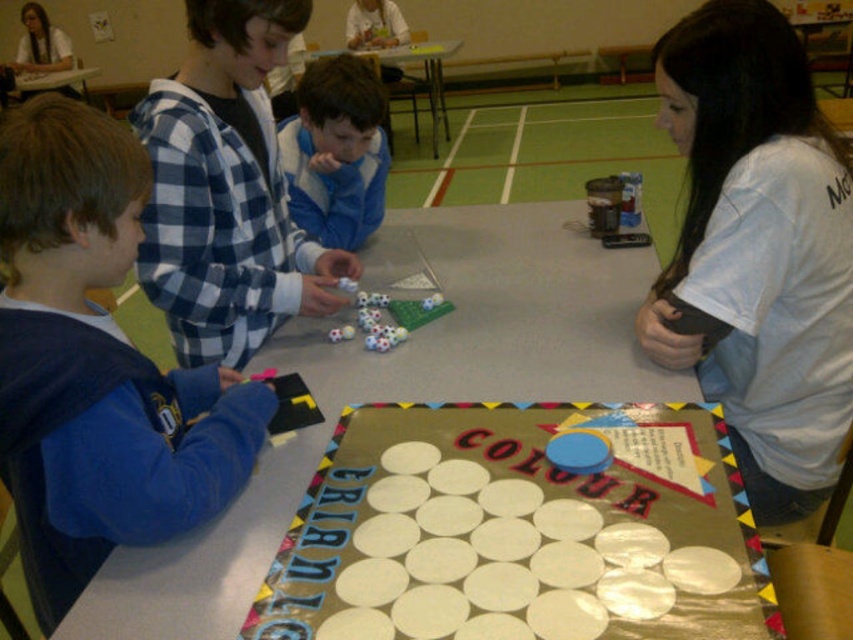
Question: Which point is closer to the camera?

Choices:
 (A) blue fleece jacket at left
 (B) blue fleece jacket at center
 (C) white plastic table at center
 (D) rubber soccer balls at center

Answer: (C)

Question: Which object is the farthest from the white plastic table at center?

Choices:
 (A) blue fleece jacket at left
 (B) white plastic circles at center
 (C) smooth plastic table at center
 (D) blue fleece jacket at center

Answer: (C)

Question: In this image, where is white plastic circles at center located relative to rubber soccer balls at center?

Choices:
 (A) below
 (B) above

Answer: (A)

Question: Is rubber soccer balls at center closer to camera compared to smooth plastic table at center?

Choices:
 (A) no
 (B) yes

Answer: (B)

Question: Which of the following is the farthest from the observer?

Choices:
 (A) (x=437, y=314)
 (B) (x=657, y=632)
 (C) (x=345, y=241)
 (D) (x=437, y=141)

Answer: (D)

Question: Does blue fleece jacket at left appear on the left side of white plastic table at center?

Choices:
 (A) no
 (B) yes

Answer: (B)